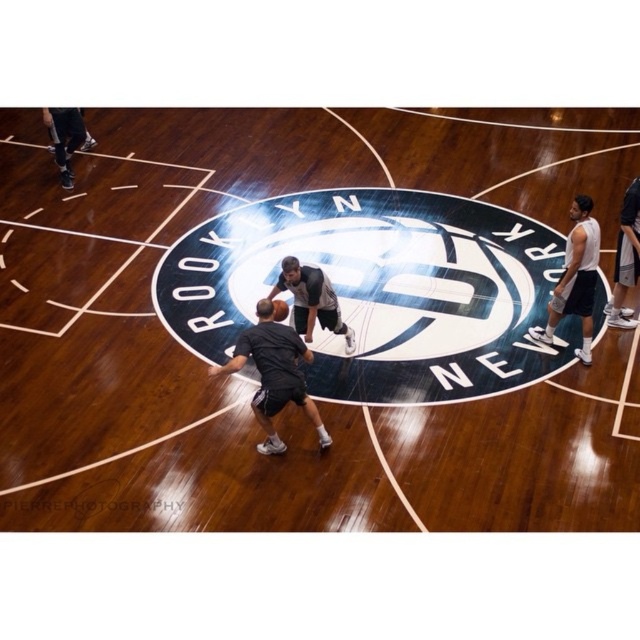
Does dark gray shorts at center appear on the left side of dark gray shorts at right?

Correct, you'll find dark gray shorts at center to the left of dark gray shorts at right.

Image resolution: width=640 pixels, height=640 pixels. What are the coordinates of `dark gray shorts at center` in the screenshot? It's located at (275, 374).

Who is more distant from viewer, (257,326) or (618,314)?

The point (618,314) is behind.

At what (x,y) coordinates should I click in order to perform the action: click on dark gray shorts at center. Please return your answer as a coordinate pair (x, y). Looking at the image, I should click on (275, 374).

This screenshot has width=640, height=640. Describe the element at coordinates (316, 326) in the screenshot. I see `wooden basketball court at center` at that location.

Between wooden basketball court at center and shiny orange basketball at center, which one is positioned higher?

wooden basketball court at center is higher up.

Is point (42, 445) positioned after point (278, 300)?

No, (42, 445) is closer to viewer.

This screenshot has width=640, height=640. In order to click on wooden basketball court at center in this screenshot , I will do `click(316, 326)`.

Looking at this image, can you confirm if gray matte basketball player at center is smaller than dark gray shorts at right?

Yes.

Consider the image. Between gray matte basketball player at center and dark gray shorts at right, which one appears on the left side from the viewer's perspective?

gray matte basketball player at center is more to the left.

Between point (314, 324) and point (614, 285), which one is positioned in front?

Point (314, 324) is in front.

The width and height of the screenshot is (640, 640). In order to click on gray matte basketball player at center in this screenshot , I will do `click(310, 300)`.